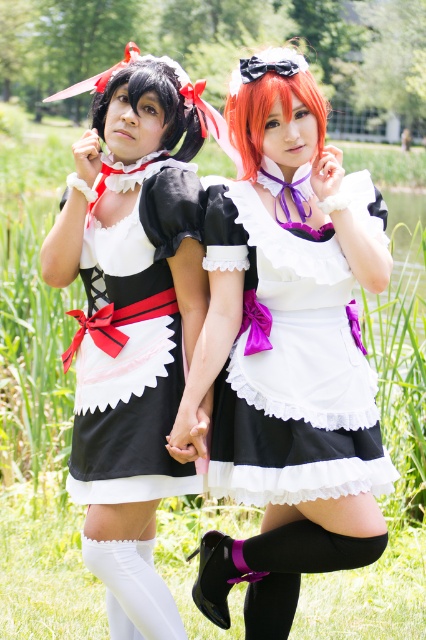
Does matte black dress at left appear over matte black dress at center?

Actually, matte black dress at left is below matte black dress at center.

Does matte black dress at left have a smaller size compared to matte black dress at center?

No.

Image resolution: width=426 pixels, height=640 pixels. In order to click on matte black dress at left in this screenshot , I will do `click(132, 326)`.

Is white satin dress at center bigger than matte black dress at left?

Correct, white satin dress at center is larger in size than matte black dress at left.

Is white satin dress at center above matte black dress at left?

No, white satin dress at center is not above matte black dress at left.

Locate an element on the screen. The width and height of the screenshot is (426, 640). white satin dress at center is located at coordinates (287, 349).

Find the location of a particular element. white satin dress at center is located at coordinates (287, 349).

Between point (210, 348) and point (164, 256), which one is positioned behind?

Point (164, 256)

Locate an element on the screen. white satin dress at center is located at coordinates (287, 349).